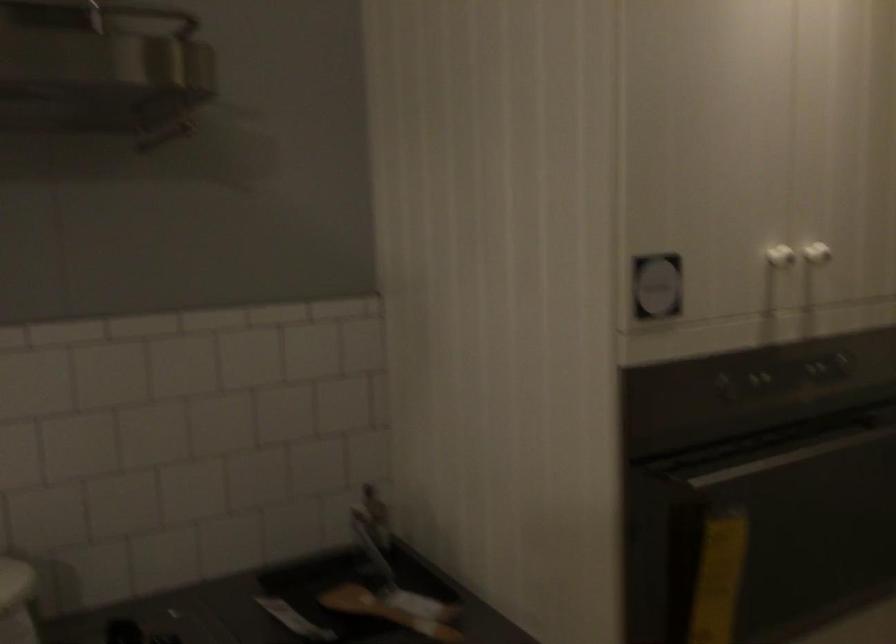
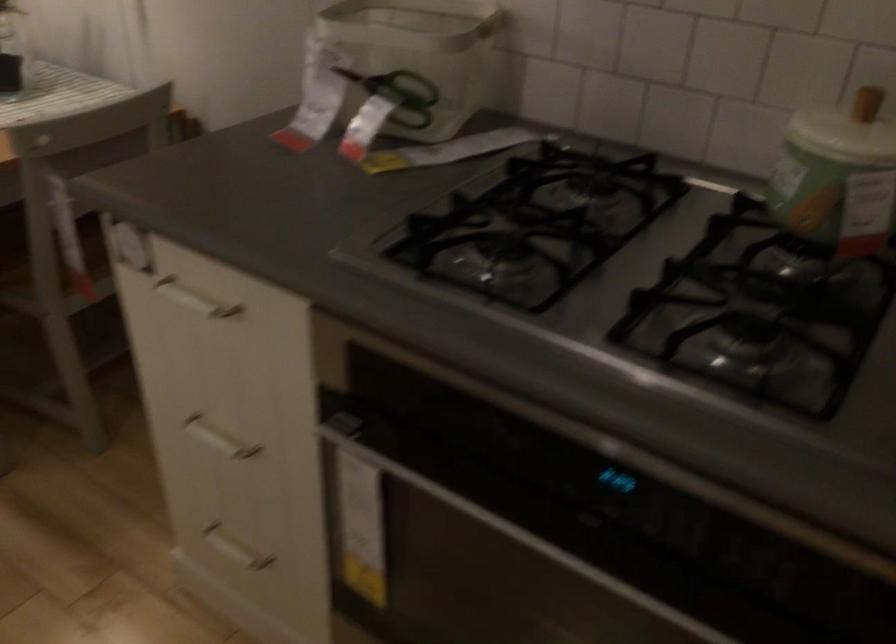
Based on the continuous images, in which direction is the camera rotating?

The camera's rotation is toward left-down.